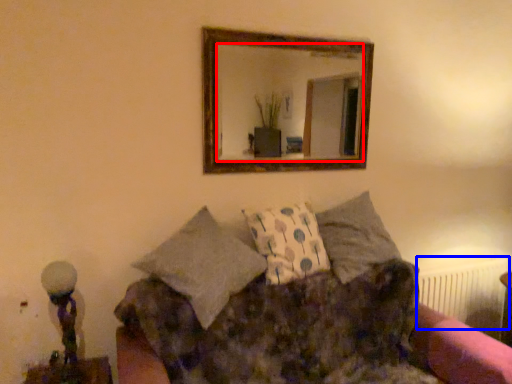
Question: Which object is closer to the camera taking this photo, mirror (highlighted by a red box) or radiator (highlighted by a blue box)?

Choices:
 (A) mirror
 (B) radiator

Answer: (A)